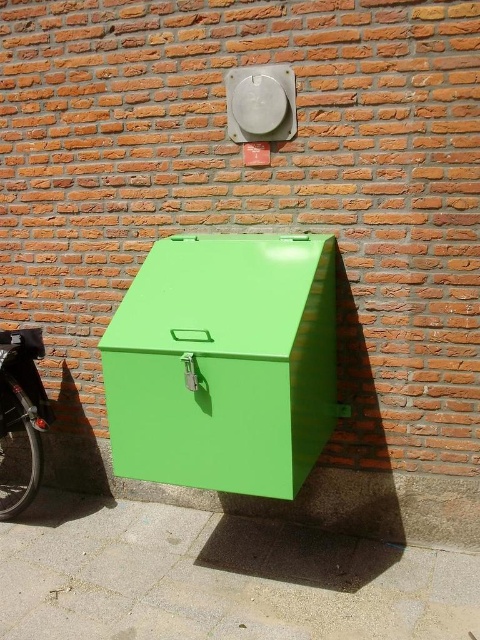
You are standing on the green matte pavement at lower center and want to reach the shiny black bicycle at lower left. Which direction should you move to get closer to the bicycle?

You should move upward because the green matte pavement at lower center is located below the shiny black bicycle at lower left, so moving upward will bring you closer to the bicycle.

You are standing in front of the metal box against the brick wall. You notice two points marked on the wall. The first point is at coordinates point (x=115, y=532) and the second point is at point (x=146, y=282). Which point is closer to you?

Point (x=115, y=532) is closer to you because it is further to the viewer than point (x=146, y=282).